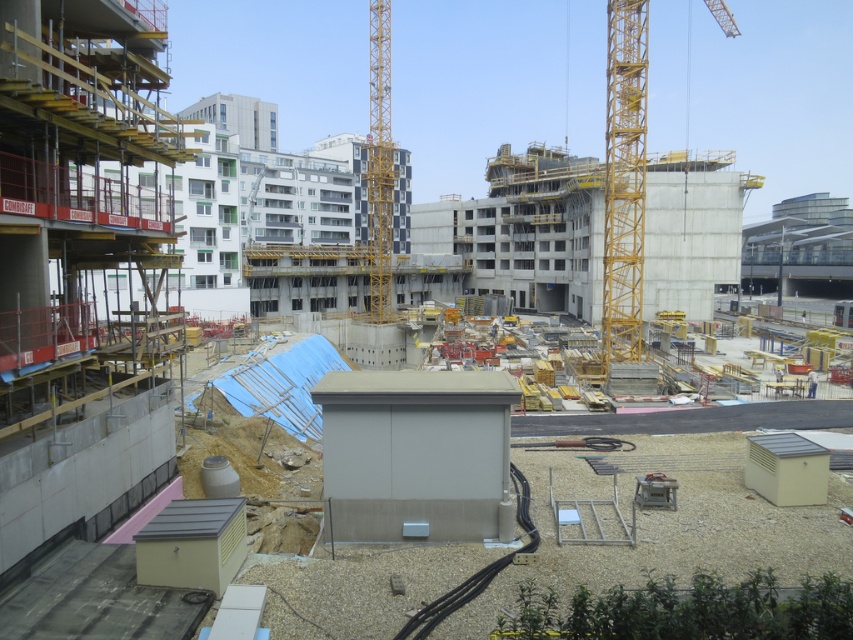
You are a construction worker standing at the base of the yellow metallic crane at upper right. You need to move to a safety zone located 40 meters away. Can you safely reach the safety zone without exceeding the crane operator? Please explain your reasoning.

The yellow metallic crane at upper right is 36.09 meters away from the safety zone. Since the safety zone is 40 meters away, you can safely reach it as the distance is within the required range.

You are a construction worker needing to transport a 30 meter long steel beam from the concrete wall at left to the yellow metallic crane at upper right. Can you safely move the beam without it touching the ground?

The distance between the concrete wall at left and the yellow metallic crane at upper right is 26.51 meters. Since the steel beam is 30 meters long, it cannot be safely transported without touching the ground as the distance is shorter than the beam.